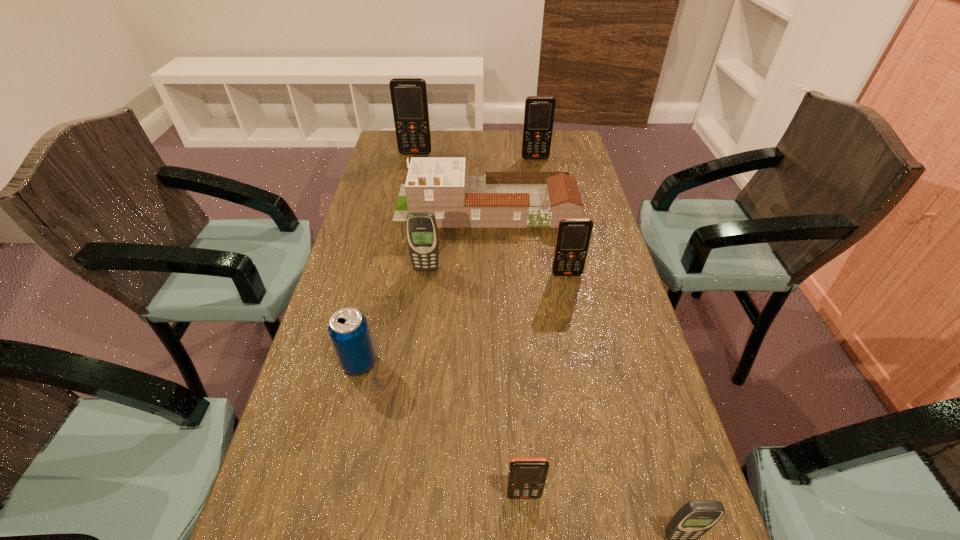
The height and width of the screenshot is (540, 960). Identify the location of dollhouse that is at the left edge. coord(440,186).

Where is `pop soda located at the left edge`? The height and width of the screenshot is (540, 960). pop soda located at the left edge is located at coordinates (348, 329).

Locate an element on the screen. The image size is (960, 540). dollhouse present at the right edge is located at coordinates (440, 186).

At what (x,y) coordinates should I click in order to perform the action: click on object located at the far left corner. Please return your answer as a coordinate pair (x, y). Looking at the image, I should click on (409, 99).

Locate an element on the screen. object present at the far right corner is located at coordinates (539, 112).

Image resolution: width=960 pixels, height=540 pixels. I want to click on vacant area at the far edge of the desktop, so (469, 153).

Locate an element on the screen. Image resolution: width=960 pixels, height=540 pixels. vacant point at the left edge is located at coordinates (337, 394).

This screenshot has width=960, height=540. I want to click on vacant area at the right edge of the desktop, so click(x=582, y=343).

The width and height of the screenshot is (960, 540). In the image, there is a desktop. What are the coordinates of `vacant space at the far right corner` in the screenshot? It's located at (579, 160).

Find the location of a particular element. vacant space that's between the blue pop soda and the second nearest orange cellular telephone is located at coordinates (463, 318).